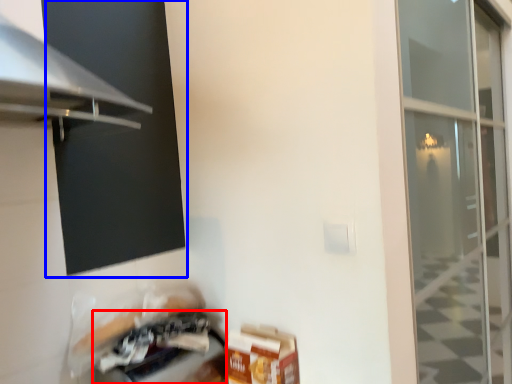
Question: Which object appears closest to the camera in this image, appliance (highlighted by a red box) or window screen (highlighted by a blue box)?

Choices:
 (A) appliance
 (B) window screen

Answer: (B)